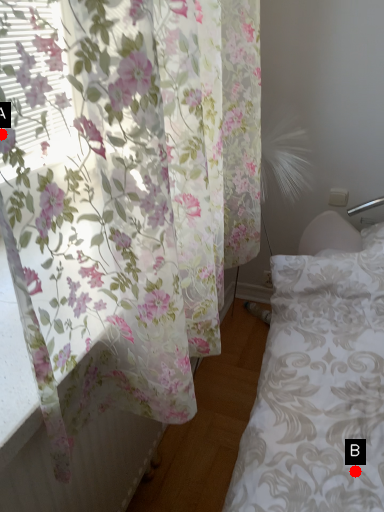
Question: Two points are circled on the image, labeled by A and B beside each circle. Which point appears farthest from the camera in this image?

Choices:
 (A) A is further
 (B) B is further

Answer: (B)